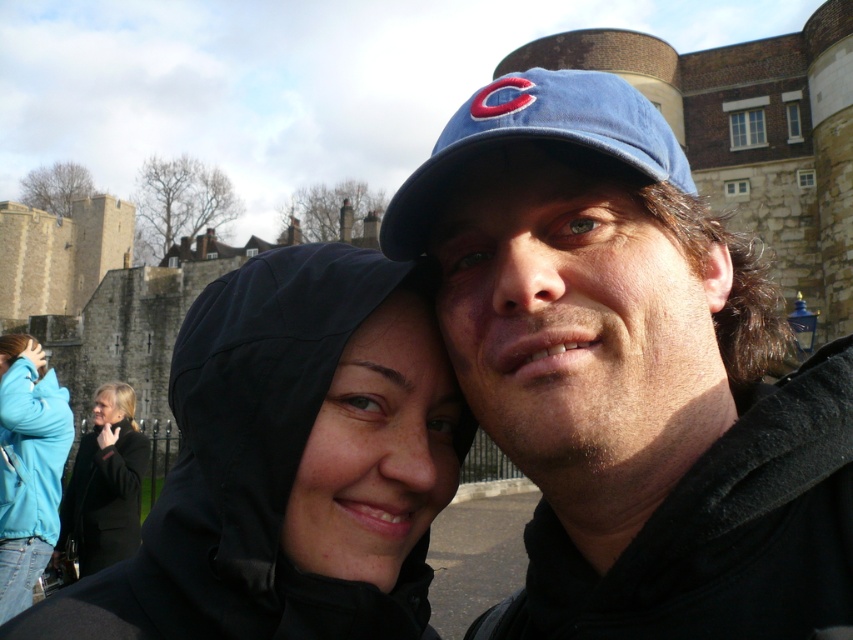
Question: Which point is farther from the camera taking this photo?

Choices:
 (A) (576, 618)
 (B) (320, 326)

Answer: (B)

Question: Which point is farther from the camera taking this photo?

Choices:
 (A) (338, 593)
 (B) (537, 211)
 (C) (625, 248)
 (D) (630, 113)

Answer: (B)

Question: Can you confirm if matte black hoodie at center is positioned to the right of turquoise fleece jacket at lower left?

Choices:
 (A) yes
 (B) no

Answer: (A)

Question: Does matte black hoodie at center appear under blue fabric baseball cap at center?

Choices:
 (A) no
 (B) yes

Answer: (B)

Question: Can you confirm if blue fabric cap at upper center is smaller than light brown skin at lower left?

Choices:
 (A) yes
 (B) no

Answer: (B)

Question: Which point is farther from the camera taking this photo?

Choices:
 (A) (619, 396)
 (B) (563, 129)
 (C) (363, 417)

Answer: (C)